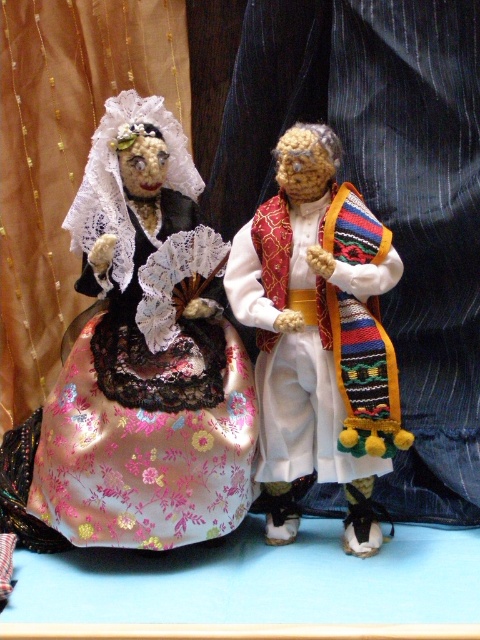
Question: From the image, what is the correct spatial relationship of silky floral dress at center in relation to knitted woolen doll at center?

Choices:
 (A) above
 (B) below

Answer: (A)

Question: Among these objects, which one is nearest to the camera?

Choices:
 (A) silky floral dress at center
 (B) knitted woolen doll at center

Answer: (B)

Question: Does silky floral dress at center come in front of knitted woolen doll at center?

Choices:
 (A) yes
 (B) no

Answer: (B)

Question: Is silky floral dress at center in front of knitted woolen doll at center?

Choices:
 (A) yes
 (B) no

Answer: (B)